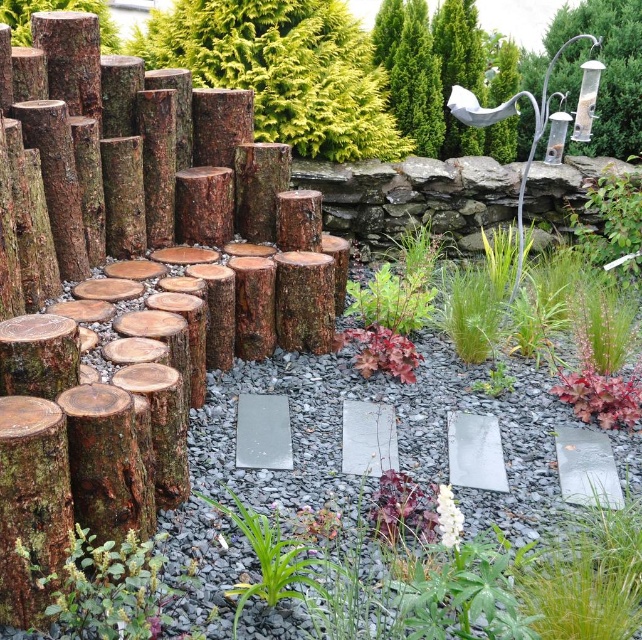
Question: Does green matte plant at lower left lie behind dark red leafy plant at center?

Choices:
 (A) yes
 (B) no

Answer: (B)

Question: Which point is farther from the camera taking this photo?

Choices:
 (A) (401, 54)
 (B) (498, 620)
 (C) (447, 92)
 (D) (629, 148)

Answer: (D)

Question: Does white paper at upper right have a smaller size compared to dark red leafy plant at center?

Choices:
 (A) yes
 (B) no

Answer: (B)

Question: Considering the real-world distances, which object is farthest from the green matte plant at lower left?

Choices:
 (A) brown rough wood at upper center
 (B) smooth brown log at upper left
 (C) dark red leafy plant at center
 (D) gray gravel at center

Answer: (B)

Question: Among these objects, which one is nearest to the camera?

Choices:
 (A) smooth brown log at upper left
 (B) green textured tree at upper center

Answer: (A)

Question: Can you confirm if red matte leaf at center is positioned to the right of green leafy plant at center?

Choices:
 (A) no
 (B) yes

Answer: (B)